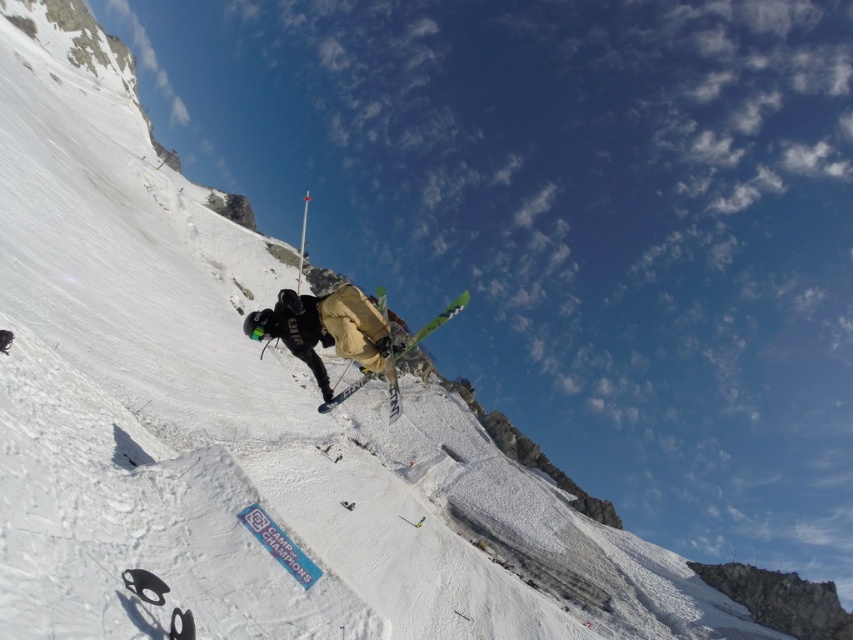
Can you confirm if matte khaki ski suit at center is smaller than green metallic skis at center?

Indeed, matte khaki ski suit at center has a smaller size compared to green metallic skis at center.

Is point (321, 323) positioned after point (358, 385)?

That is False.

This screenshot has width=853, height=640. In order to click on matte khaki ski suit at center in this screenshot , I will do `click(323, 330)`.